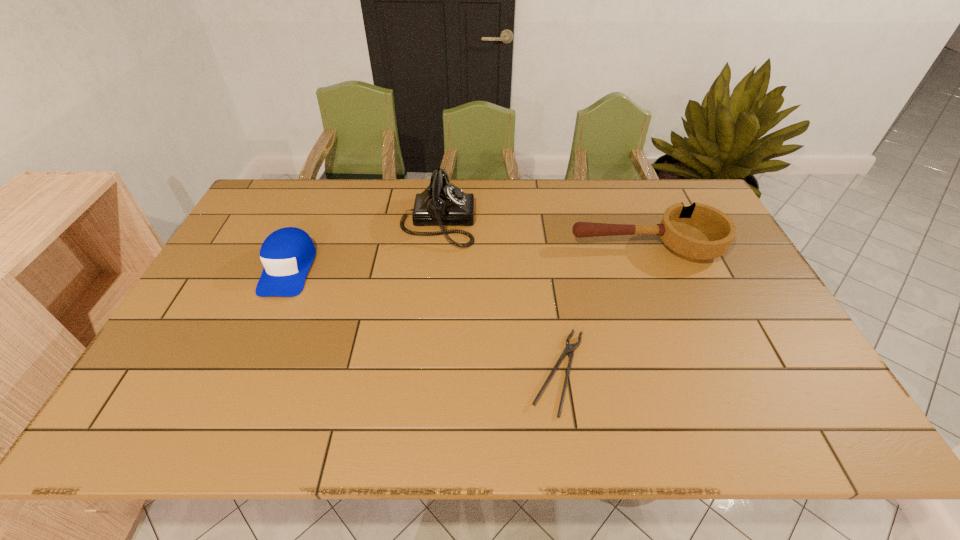
This screenshot has height=540, width=960. Identify the location of the tallest object. (441, 203).

This screenshot has height=540, width=960. I want to click on telephone, so click(x=441, y=203).

What are the coordinates of `the leftmost object` in the screenshot? It's located at (287, 254).

Identify the location of the rightmost object. This screenshot has width=960, height=540. (697, 232).

Identify the location of the nearest object. (569, 349).

I want to click on the shortest object, so click(569, 349).

Find the location of a particular element. The image size is (960, 540). vacant space positioned on the dial of the tallest object is located at coordinates (506, 222).

At what (x,y) coordinates should I click in order to perform the action: click on vacant space located on the front-facing side of the baseball cap. Please return your answer as a coordinate pair (x, y). This screenshot has height=540, width=960. Looking at the image, I should click on (226, 411).

Find the location of `free space located with the handle on the side of the saucepan`. free space located with the handle on the side of the saucepan is located at coordinates (537, 246).

The height and width of the screenshot is (540, 960). I want to click on vacant space situated with the handle on the side of the saucepan, so click(508, 246).